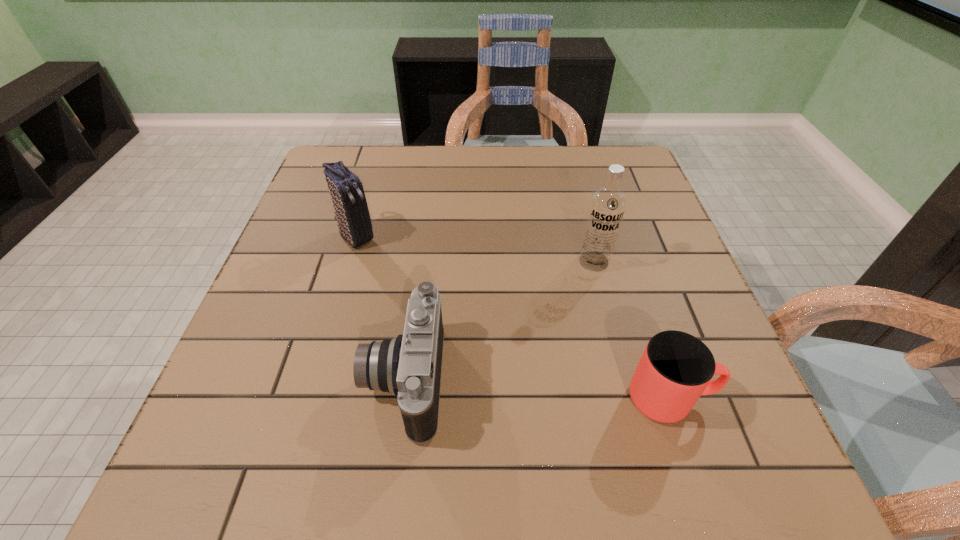
You are a GUI agent. You are given a task and a screenshot of the screen. Output one action in this format:
    pyautogui.click(x=<x>, y=<y>)
    Task: Click on the vodka that is positioned at the right edge
    Image resolution: width=960 pixels, height=540 pixels.
    Given the screenshot: What is the action you would take?
    pyautogui.click(x=607, y=206)

This screenshot has width=960, height=540. I want to click on object situated at the near right corner, so click(676, 368).

At what (x,y) coordinates should I click in order to perform the action: click on vacant area at the far edge. Please return your answer as a coordinate pair (x, y). This screenshot has height=540, width=960. Looking at the image, I should click on (557, 165).

The height and width of the screenshot is (540, 960). In the image, there is a desktop. Find the location of `free space at the near edge`. free space at the near edge is located at coordinates (628, 423).

The height and width of the screenshot is (540, 960). I want to click on vacant space at the left edge, so click(342, 252).

In the image, there is a desktop. Where is `vacant space at the right edge`? This screenshot has width=960, height=540. vacant space at the right edge is located at coordinates (665, 219).

Where is `free space at the far right corner`? Image resolution: width=960 pixels, height=540 pixels. free space at the far right corner is located at coordinates (647, 192).

Where is `vacant area that lies between the leftmost object and the third object from right to left`? The height and width of the screenshot is (540, 960). vacant area that lies between the leftmost object and the third object from right to left is located at coordinates (380, 308).

Where is `empty space between the camera and the tallest object`? The height and width of the screenshot is (540, 960). empty space between the camera and the tallest object is located at coordinates 499,320.

Locate an element on the screen. free space between the third tallest object and the clutch bag is located at coordinates 380,308.